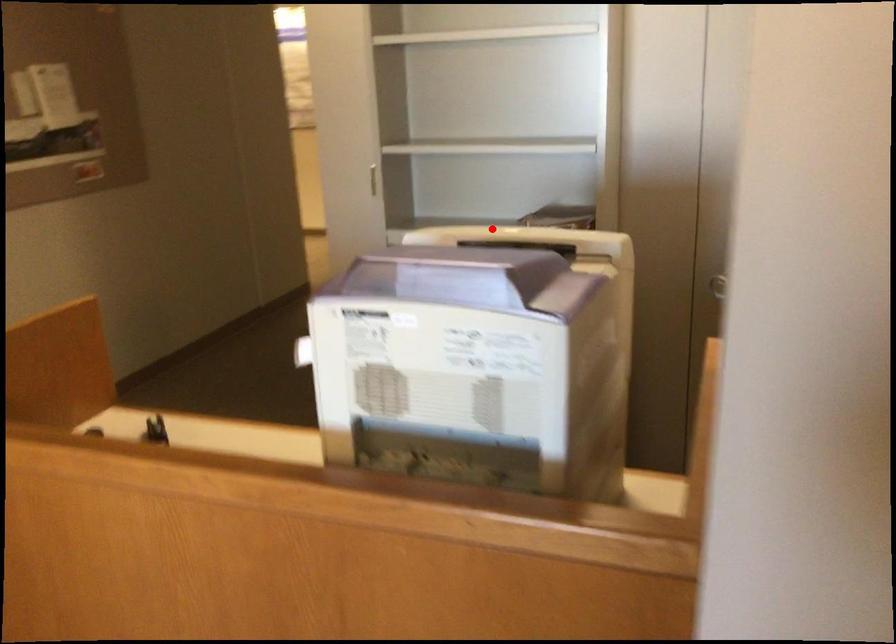
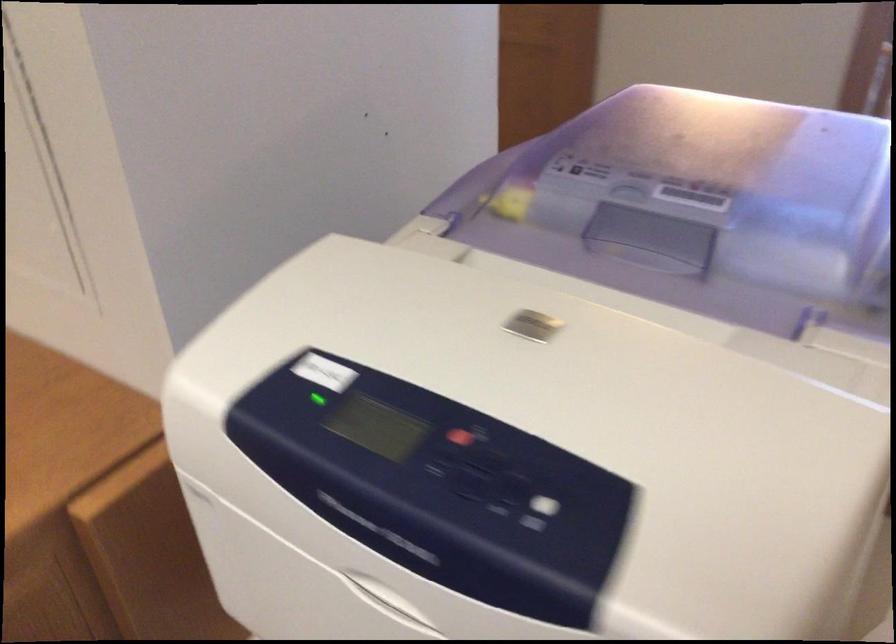
In the second image, find the point that corresponds to the highlighted location in the first image.

(539, 325)